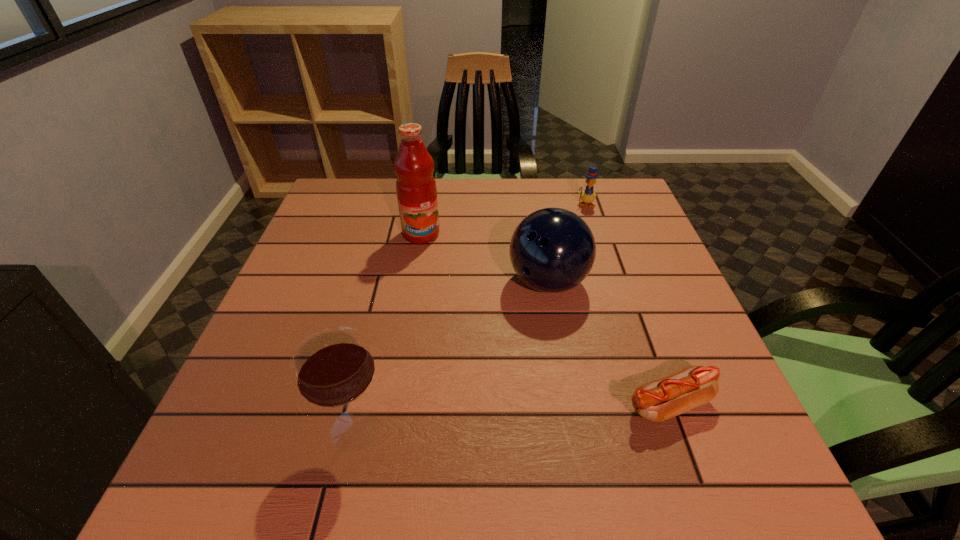
I want to click on vacant space located 0.180m on the surface of the third nearest object near the finger holes, so click(x=505, y=370).

Image resolution: width=960 pixels, height=540 pixels. I want to click on vacant space positioned 0.150m on the surface of the third nearest object near the finger holes, so click(x=511, y=359).

Where is `free space located on the surface of the third nearest object near the finger holes`? free space located on the surface of the third nearest object near the finger holes is located at coordinates (485, 413).

Image resolution: width=960 pixels, height=540 pixels. Find the location of `free space located 0.110m on the front label of the fruit juice`. free space located 0.110m on the front label of the fruit juice is located at coordinates (443, 270).

The width and height of the screenshot is (960, 540). What are the coordinates of `vacant space positioned 0.110m on the front label of the fruit juice` in the screenshot? It's located at (443, 270).

This screenshot has height=540, width=960. In order to click on blank area located 0.330m on the front label of the fruit juice in this screenshot , I will do `click(480, 333)`.

Where is `free space located 0.350m on the face of the duckling, where the monocle is placed`? free space located 0.350m on the face of the duckling, where the monocle is placed is located at coordinates (569, 289).

You are a GUI agent. You are given a task and a screenshot of the screen. Output one action in this format:
    pyautogui.click(x=<x>, y=<y>)
    Task: Click on the vacant region located on the face of the duckling, where the monocle is placed
    The width and height of the screenshot is (960, 540).
    Given the screenshot: What is the action you would take?
    pyautogui.click(x=573, y=271)

I want to click on vacant point located 0.070m on the face of the duckling, where the monocle is placed, so click(x=582, y=222).

The width and height of the screenshot is (960, 540). In order to click on fruit juice located at the far edge in this screenshot , I will do `click(416, 189)`.